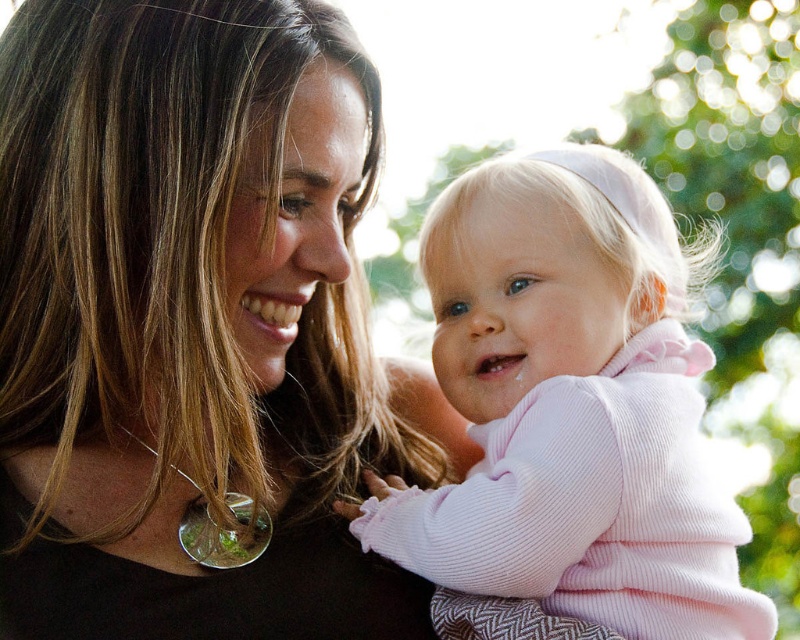
Does matte black shirt at center have a greater width compared to pink corduroy baby at center?

Indeed, matte black shirt at center has a greater width compared to pink corduroy baby at center.

Is point (142, 371) farther from viewer compared to point (520, 484)?

That is True.

Which is behind, point (325, 442) or point (601, 211)?

The point (325, 442) is more distant.

Locate an element on the screen. matte black shirt at center is located at coordinates (194, 323).